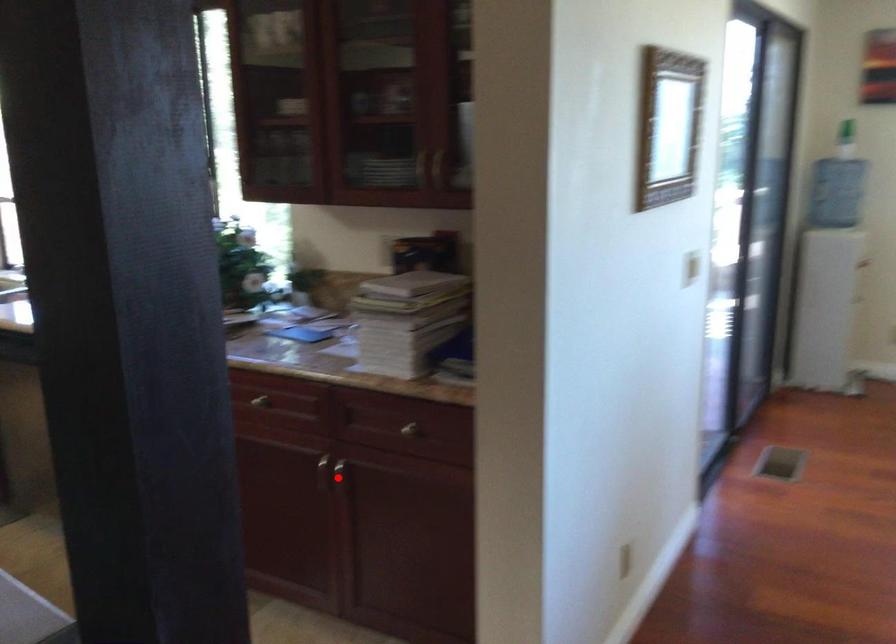
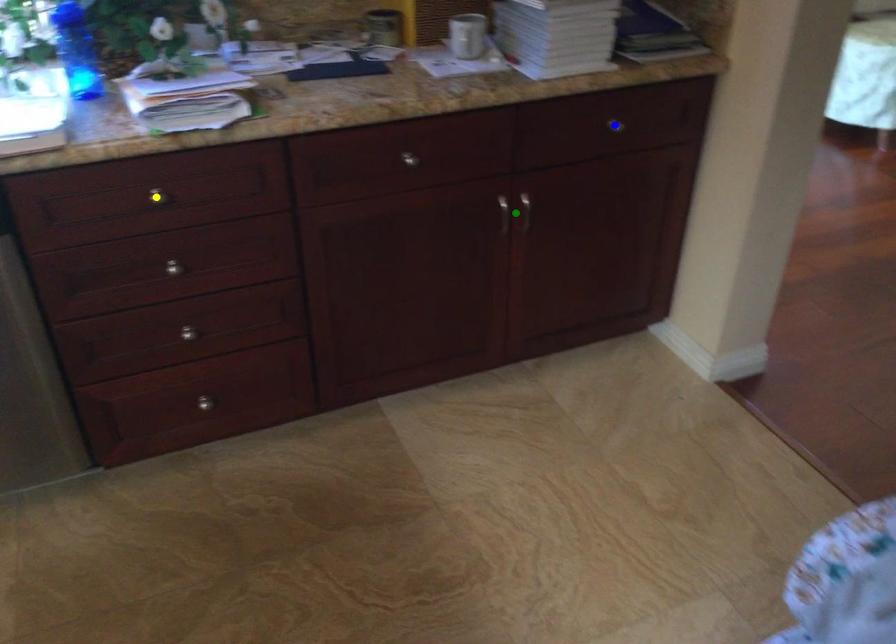
Question: I am providing you with two images of the same scene from different viewpoints. A red point is marked on the first image. You are given multiple points on the second image. Can you choose the point in image 2 that corresponds to the point in image 1?

Choices:
 (A) blue point
 (B) green point
 (C) yellow point

Answer: (B)